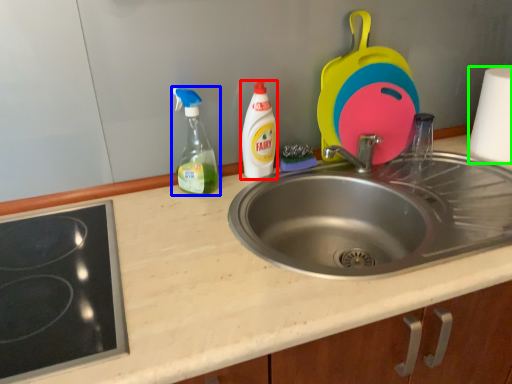
Question: Which is farther away from bottle (highlighted by a red box)? bottle (highlighted by a blue box) or paper towel (highlighted by a green box)?

Choices:
 (A) bottle
 (B) paper towel

Answer: (B)